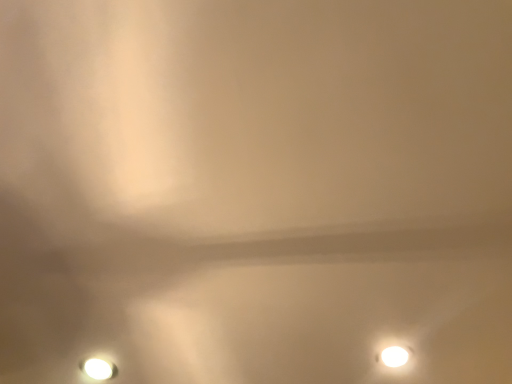
Find the location of a particular element. This screenshot has width=512, height=384. white glossy lamp at lower right, arranged as the 2th lamp when viewed from the left is located at coordinates (394, 356).

The image size is (512, 384). What do you see at coordinates (394, 356) in the screenshot?
I see `white glossy lamp at lower right, which is the first lamp in right-to-left order` at bounding box center [394, 356].

Consider the image. Measure the distance between white glossy lamp at lower right, arranged as the 2th lamp when viewed from the left, and camera.

white glossy lamp at lower right, arranged as the 2th lamp when viewed from the left, and camera are 36.38 inches apart from each other.

The image size is (512, 384). What are the coordinates of `white glossy lamp at lower left, the first lamp positioned from the left` in the screenshot? It's located at (99, 369).

The width and height of the screenshot is (512, 384). Describe the element at coordinates (99, 369) in the screenshot. I see `white glossy lamp at lower left, acting as the second lamp starting from the right` at that location.

Measure the distance between white glossy lamp at lower left, the first lamp positioned from the left, and camera.

The distance of white glossy lamp at lower left, the first lamp positioned from the left, from camera is 36.77 inches.

Find the location of a particular element. white glossy lamp at lower right, which is the first lamp in right-to-left order is located at coordinates (394, 356).

Which is more to the right, white glossy lamp at lower left, the first lamp positioned from the left, or white glossy lamp at lower right, which is the first lamp in right-to-left order?

From the viewer's perspective, white glossy lamp at lower right, which is the first lamp in right-to-left order, appears more on the right side.

Who is more distant, white glossy lamp at lower left, the first lamp positioned from the left, or white glossy lamp at lower right, which is the first lamp in right-to-left order?

white glossy lamp at lower left, the first lamp positioned from the left, is more distant.

Does point (100, 361) come farther from viewer compared to point (403, 354)?

Yes, it is.

From the image's perspective, is white glossy lamp at lower left, the first lamp positioned from the left, beneath white glossy lamp at lower right, arranged as the 2th lamp when viewed from the left?

Yes.

From a real-world perspective, which is physically below, white glossy lamp at lower left, acting as the second lamp starting from the right, or white glossy lamp at lower right, arranged as the 2th lamp when viewed from the left?

white glossy lamp at lower right, arranged as the 2th lamp when viewed from the left, is physically lower.

Considering the sizes of objects white glossy lamp at lower left, acting as the second lamp starting from the right, and white glossy lamp at lower right, which is the first lamp in right-to-left order, in the image provided, who is wider, white glossy lamp at lower left, acting as the second lamp starting from the right, or white glossy lamp at lower right, which is the first lamp in right-to-left order,?

white glossy lamp at lower left, acting as the second lamp starting from the right, is wider.

Considering the relative sizes of white glossy lamp at lower left, acting as the second lamp starting from the right, and white glossy lamp at lower right, which is the first lamp in right-to-left order, in the image provided, is white glossy lamp at lower left, acting as the second lamp starting from the right, taller than white glossy lamp at lower right, which is the first lamp in right-to-left order,?

No.

In terms of size, does white glossy lamp at lower left, acting as the second lamp starting from the right, appear bigger or smaller than white glossy lamp at lower right, which is the first lamp in right-to-left order?

Considering their sizes, white glossy lamp at lower left, acting as the second lamp starting from the right, takes up less space than white glossy lamp at lower right, which is the first lamp in right-to-left order.

Can we say white glossy lamp at lower left, the first lamp positioned from the left, lies outside white glossy lamp at lower right, which is the first lamp in right-to-left order?

white glossy lamp at lower left, the first lamp positioned from the left, is positioned outside white glossy lamp at lower right, which is the first lamp in right-to-left order.

Can you see white glossy lamp at lower left, the first lamp positioned from the left, touching white glossy lamp at lower right, which is the first lamp in right-to-left order?

No, white glossy lamp at lower left, the first lamp positioned from the left, is not touching white glossy lamp at lower right, which is the first lamp in right-to-left order.

Is white glossy lamp at lower left, acting as the second lamp starting from the right, oriented towards white glossy lamp at lower right, arranged as the 2th lamp when viewed from the left?

Yes, white glossy lamp at lower left, acting as the second lamp starting from the right, is facing white glossy lamp at lower right, arranged as the 2th lamp when viewed from the left.

How far apart are white glossy lamp at lower left, the first lamp positioned from the left, and white glossy lamp at lower right, which is the first lamp in right-to-left order?

A distance of 24.46 inches exists between white glossy lamp at lower left, the first lamp positioned from the left, and white glossy lamp at lower right, which is the first lamp in right-to-left order.

The image size is (512, 384). I want to click on lamp above the white glossy lamp at lower right, which is the first lamp in right-to-left order (from a real-world perspective), so click(x=99, y=369).

Is white glossy lamp at lower right, arranged as the 2th lamp when viewed from the left, to the right of white glossy lamp at lower left, the first lamp positioned from the left, from the viewer's perspective?

Indeed, white glossy lamp at lower right, arranged as the 2th lamp when viewed from the left, is positioned on the right side of white glossy lamp at lower left, the first lamp positioned from the left.

Considering the relative positions of white glossy lamp at lower right, arranged as the 2th lamp when viewed from the left, and white glossy lamp at lower left, acting as the second lamp starting from the right, in the image provided, is white glossy lamp at lower right, arranged as the 2th lamp when viewed from the left, behind white glossy lamp at lower left, acting as the second lamp starting from the right,?

No, it is in front of white glossy lamp at lower left, acting as the second lamp starting from the right.

Is point (390, 350) behind point (93, 368)?

No, it is in front of (93, 368).

From the image's perspective, is white glossy lamp at lower right, arranged as the 2th lamp when viewed from the left, over white glossy lamp at lower left, the first lamp positioned from the left?

Yes.

From a real-world perspective, is white glossy lamp at lower right, arranged as the 2th lamp when viewed from the left, positioned under white glossy lamp at lower left, acting as the second lamp starting from the right, based on gravity?

Yes, from a real-world perspective, white glossy lamp at lower right, arranged as the 2th lamp when viewed from the left, is below white glossy lamp at lower left, acting as the second lamp starting from the right.

Does white glossy lamp at lower right, which is the first lamp in right-to-left order, have a lesser width compared to white glossy lamp at lower left, the first lamp positioned from the left?

Correct, the width of white glossy lamp at lower right, which is the first lamp in right-to-left order, is less than that of white glossy lamp at lower left, the first lamp positioned from the left.

From the picture: Is white glossy lamp at lower right, which is the first lamp in right-to-left order, taller or shorter than white glossy lamp at lower left, the first lamp positioned from the left?

white glossy lamp at lower right, which is the first lamp in right-to-left order, is taller than white glossy lamp at lower left, the first lamp positioned from the left.

Considering the sizes of objects white glossy lamp at lower right, arranged as the 2th lamp when viewed from the left, and white glossy lamp at lower left, the first lamp positioned from the left, in the image provided, who is bigger, white glossy lamp at lower right, arranged as the 2th lamp when viewed from the left, or white glossy lamp at lower left, the first lamp positioned from the left,?

white glossy lamp at lower right, arranged as the 2th lamp when viewed from the left, is bigger.

Is white glossy lamp at lower right, which is the first lamp in right-to-left order, positioned beyond the bounds of white glossy lamp at lower left, acting as the second lamp starting from the right?

Yes, white glossy lamp at lower right, which is the first lamp in right-to-left order, is located beyond the bounds of white glossy lamp at lower left, acting as the second lamp starting from the right.

Is white glossy lamp at lower right, arranged as the 2th lamp when viewed from the left, placed right next to white glossy lamp at lower left, acting as the second lamp starting from the right?

No, white glossy lamp at lower right, arranged as the 2th lamp when viewed from the left, is not touching white glossy lamp at lower left, acting as the second lamp starting from the right.

Is white glossy lamp at lower right, which is the first lamp in right-to-left order, facing towards white glossy lamp at lower left, acting as the second lamp starting from the right?

Yes.

This screenshot has width=512, height=384. What are the coordinates of `lamp above the white glossy lamp at lower left, acting as the second lamp starting from the right (from the image's perspective)` in the screenshot? It's located at pos(394,356).

Locate an element on the screen. The image size is (512, 384). lamp behind the white glossy lamp at lower right, which is the first lamp in right-to-left order is located at coordinates (99, 369).

Image resolution: width=512 pixels, height=384 pixels. In the image, there is a white glossy lamp at lower right, which is the first lamp in right-to-left order. In order to click on lamp below it (from the image's perspective) in this screenshot , I will do `click(99, 369)`.